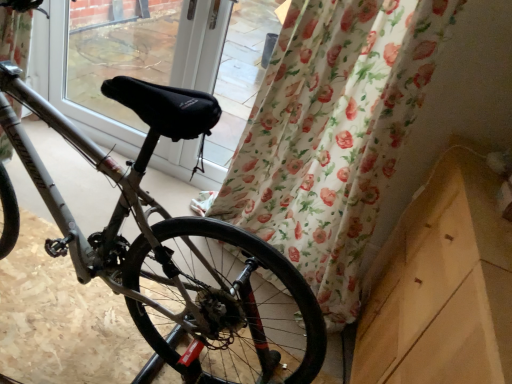
Question: Can you confirm if black fabric at center is bigger than silver metallic bicycle at center?

Choices:
 (A) no
 (B) yes

Answer: (A)

Question: Considering the relative sizes of black fabric at center and silver metallic bicycle at center in the image provided, is black fabric at center thinner than silver metallic bicycle at center?

Choices:
 (A) no
 (B) yes

Answer: (B)

Question: Does black fabric at center contain silver metallic bicycle at center?

Choices:
 (A) no
 (B) yes

Answer: (A)

Question: From the image's perspective, is black fabric at center on silver metallic bicycle at center?

Choices:
 (A) yes
 (B) no

Answer: (A)

Question: From a real-world perspective, is black fabric at center over silver metallic bicycle at center?

Choices:
 (A) no
 (B) yes

Answer: (A)

Question: Is black fabric at center taller than silver metallic bicycle at center?

Choices:
 (A) yes
 (B) no

Answer: (A)

Question: Can you confirm if silver metallic bicycle at center is smaller than silver metallic bicycle wheel at lower left?

Choices:
 (A) no
 (B) yes

Answer: (A)

Question: Would you say silver metallic bicycle at center is outside silver metallic bicycle wheel at lower left?

Choices:
 (A) yes
 (B) no

Answer: (A)

Question: Considering the relative positions of silver metallic bicycle at center and silver metallic bicycle wheel at lower left in the image provided, is silver metallic bicycle at center behind silver metallic bicycle wheel at lower left?

Choices:
 (A) yes
 (B) no

Answer: (B)

Question: Considering the relative positions of silver metallic bicycle at center and silver metallic bicycle wheel at lower left in the image provided, is silver metallic bicycle at center in front of silver metallic bicycle wheel at lower left?

Choices:
 (A) no
 (B) yes

Answer: (B)

Question: Does silver metallic bicycle at center have a lesser height compared to silver metallic bicycle wheel at lower left?

Choices:
 (A) no
 (B) yes

Answer: (A)

Question: Considering the relative sizes of silver metallic bicycle at center and silver metallic bicycle wheel at lower left in the image provided, is silver metallic bicycle at center bigger than silver metallic bicycle wheel at lower left?

Choices:
 (A) no
 (B) yes

Answer: (B)

Question: From the image's perspective, is silver metallic bicycle wheel at lower left below floral fabric curtain at lower right?

Choices:
 (A) no
 (B) yes

Answer: (B)